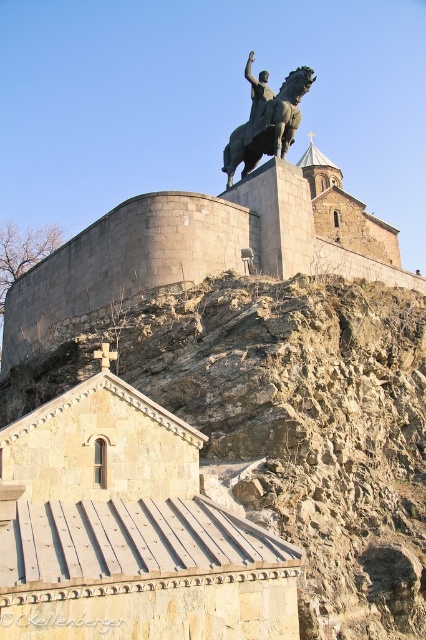
You are standing at the bottom of the hill looking up at the scene. Which object, the brown rocky hillside at upper center or the bronze statue at upper center, is closer to you?

The brown rocky hillside at upper center is closer to you because it is in front of the bronze statue at upper center.

You are standing at the base of the statue and want to take a photo of the bronze statue at upper center with the brown rocky hillside at upper center in the background. Which direction should you face to ensure both are visible in your frame?

You should face to the right of the bronze statue at upper center so that the brown rocky hillside at upper center appears in the background. Since the brown rocky hillside at upper center is located to the left of the bronze statue at upper center, facing right would position the statue in the foreground and the hillside behind it within the frame.